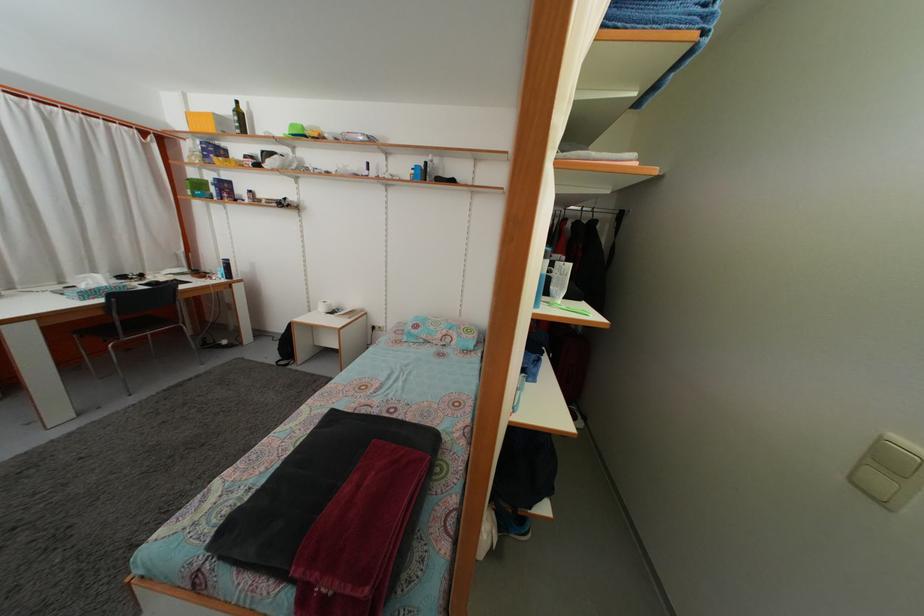
Which object does [201,121] point to?

It refers to a yellow cardboard box.